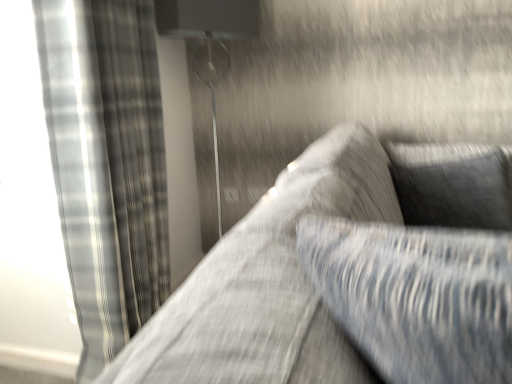
What do you see at coordinates (452, 185) in the screenshot? I see `black textured pillow at upper right` at bounding box center [452, 185].

This screenshot has width=512, height=384. What do you see at coordinates (267, 284) in the screenshot?
I see `textured gray couch at center` at bounding box center [267, 284].

Identify the location of plaid fabric curtain at left. The image size is (512, 384). (106, 164).

Looking at their sizes, would you say black textured pillow at upper right is wider or thinner than textured gray couch at center?

In the image, black textured pillow at upper right appears to be more narrow than textured gray couch at center.

Which is correct: black textured pillow at upper right is inside textured gray couch at center, or outside of it?

black textured pillow at upper right is enclosed within textured gray couch at center.

Is black textured pillow at upper right not near textured gray couch at center?

black textured pillow at upper right is actually quite close to textured gray couch at center.

From the image's perspective, does textured gray couch at center appear higher than black textured pillow at upper right?

Indeed, from the image's perspective, textured gray couch at center is shown above black textured pillow at upper right.

Which object is closer to the camera taking this photo, textured gray couch at center or black textured pillow at upper right?

Positioned in front is textured gray couch at center.

From the picture: Is textured gray couch at center directly adjacent to black textured pillow at upper right?

No, textured gray couch at center is not next to black textured pillow at upper right.

Which of these two, plaid fabric curtain at left or metallic silver lamp at upper center, is wider?

metallic silver lamp at upper center is wider.

From the picture: Which object is further away from the camera taking this photo, plaid fabric curtain at left or metallic silver lamp at upper center?

metallic silver lamp at upper center is behind.

From a real-world perspective, between plaid fabric curtain at left and metallic silver lamp at upper center, who is vertically higher?

metallic silver lamp at upper center is physically above.

Measure the distance between plaid fabric curtain at left and metallic silver lamp at upper center.

23.11 inches.

Does metallic silver lamp at upper center contain textured gray couch at center?

No.

From the image's perspective, is metallic silver lamp at upper center under textured gray couch at center?

Actually, metallic silver lamp at upper center appears above textured gray couch at center in the image.

Where is `lamp positioned vertically above the textured gray couch at center (from a real-world perspective)`? This screenshot has width=512, height=384. lamp positioned vertically above the textured gray couch at center (from a real-world perspective) is located at coordinates (209, 45).

Which point is more distant from viewer, (186, 3) or (177, 291)?

The point (186, 3) is farther.

Considering the sizes of objects black textured pillow at upper right and plaid fabric curtain at left in the image provided, who is shorter, black textured pillow at upper right or plaid fabric curtain at left?

black textured pillow at upper right is shorter.

Is black textured pillow at upper right looking in the opposite direction of plaid fabric curtain at left?

No, plaid fabric curtain at left is not at the back of black textured pillow at upper right.

Considering the relative sizes of black textured pillow at upper right and plaid fabric curtain at left in the image provided, is black textured pillow at upper right bigger than plaid fabric curtain at left?

Actually, black textured pillow at upper right might be smaller than plaid fabric curtain at left.

Is black textured pillow at upper right positioned behind plaid fabric curtain at left?

Yes, black textured pillow at upper right is further from the camera.

From the image's perspective, between black textured pillow at upper right and metallic silver lamp at upper center, who is located below?

black textured pillow at upper right.

Considering the positions of objects black textured pillow at upper right and metallic silver lamp at upper center in the image provided, who is more to the left, black textured pillow at upper right or metallic silver lamp at upper center?

metallic silver lamp at upper center is more to the left.

Is black textured pillow at upper right located outside metallic silver lamp at upper center?

Yes, black textured pillow at upper right is located beyond the bounds of metallic silver lamp at upper center.

Is black textured pillow at upper right facing towards metallic silver lamp at upper center?

No, black textured pillow at upper right is not facing towards metallic silver lamp at upper center.

Is metallic silver lamp at upper center facing away from black textured pillow at upper right?

metallic silver lamp at upper center does not have its back to black textured pillow at upper right.

Is metallic silver lamp at upper center with black textured pillow at upper right?

No, metallic silver lamp at upper center is not making contact with black textured pillow at upper right.

Could black textured pillow at upper right be considered to be inside metallic silver lamp at upper center?

No, black textured pillow at upper right is not surrounded by metallic silver lamp at upper center.

Does point (207, 38) lie in front of point (423, 178)?

No, it is behind (423, 178).

The width and height of the screenshot is (512, 384). Find the location of `studio couch that appears above the black textured pillow at upper right (from the image's perspective)`. studio couch that appears above the black textured pillow at upper right (from the image's perspective) is located at coordinates (267, 284).

Identify the location of pillow below the textured gray couch at center (from the image's perspective). (452, 185).

Considering their positions, is metallic silver lamp at upper center positioned closer to black textured pillow at upper right than plaid fabric curtain at left?

The object closer to black textured pillow at upper right is plaid fabric curtain at left.

Considering their positions, is textured gray couch at center positioned closer to metallic silver lamp at upper center than plaid fabric curtain at left?

plaid fabric curtain at left lies closer to metallic silver lamp at upper center than the other object.

From the picture: Estimate the real-world distances between objects in this image. Which object is closer to black textured pillow at upper right, metallic silver lamp at upper center or textured gray couch at center?

textured gray couch at center.

Estimate the real-world distances between objects in this image. Which object is closer to metallic silver lamp at upper center, textured gray couch at center or black textured pillow at upper right?

The object closer to metallic silver lamp at upper center is textured gray couch at center.

Considering their positions, is metallic silver lamp at upper center positioned further to plaid fabric curtain at left than black textured pillow at upper right?

Based on the image, black textured pillow at upper right appears to be further to plaid fabric curtain at left.

When comparing their distances from plaid fabric curtain at left, does textured gray couch at center or metallic silver lamp at upper center seem further?

Among the two, textured gray couch at center is located further to plaid fabric curtain at left.

When comparing their distances from metallic silver lamp at upper center, does black textured pillow at upper right or plaid fabric curtain at left seem closer?

Among the two, plaid fabric curtain at left is located nearer to metallic silver lamp at upper center.

Based on the photo, estimate the real-world distances between objects in this image. Which object is further from textured gray couch at center, metallic silver lamp at upper center or plaid fabric curtain at left?

metallic silver lamp at upper center lies further to textured gray couch at center than the other object.

You are a GUI agent. You are given a task and a screenshot of the screen. Output one action in this format:
    pyautogui.click(x=<x>, y=<y>)
    Task: Click on the curtain positioned between textured gray couch at center and black textured pillow at upper right from near to far
    Image resolution: width=512 pixels, height=384 pixels.
    Given the screenshot: What is the action you would take?
    pyautogui.click(x=106, y=164)

Identify the location of pillow positioned between textured gray couch at center and metallic silver lamp at upper center from near to far. The width and height of the screenshot is (512, 384). (452, 185).

At what (x,y) coordinates should I click in order to perform the action: click on lamp located between plaid fabric curtain at left and black textured pillow at upper right in the left-right direction. Please return your answer as a coordinate pair (x, y). Looking at the image, I should click on (209, 45).

Locate an element on the screen. curtain between textured gray couch at center and metallic silver lamp at upper center from front to back is located at coordinates click(x=106, y=164).